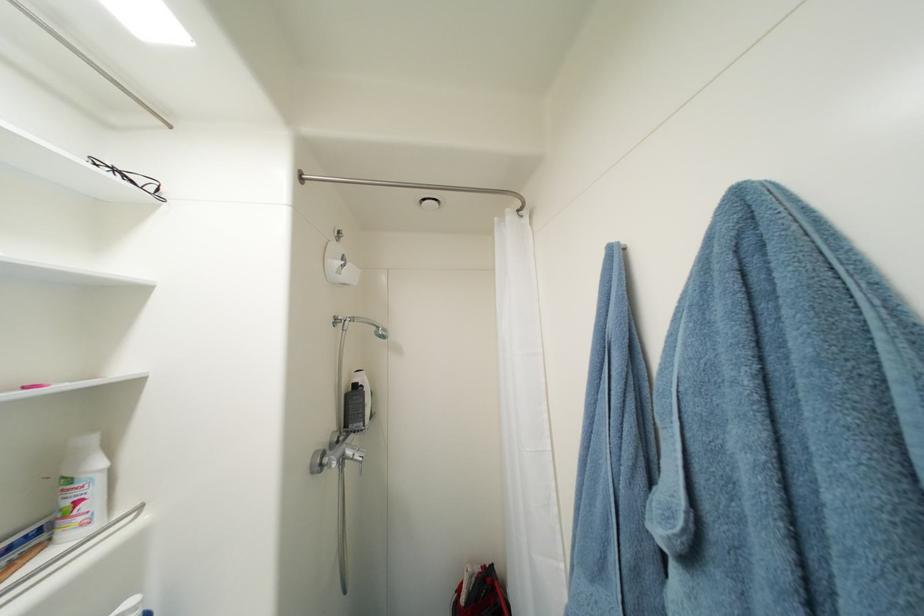
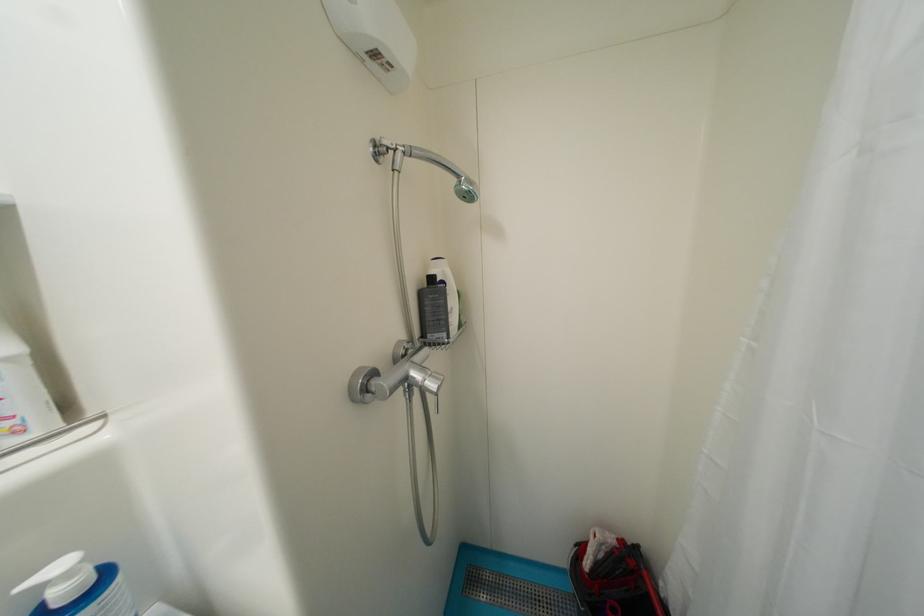
First-person continuous shooting, in which direction is the camera rotating?

The rotation direction of the camera is left-down.